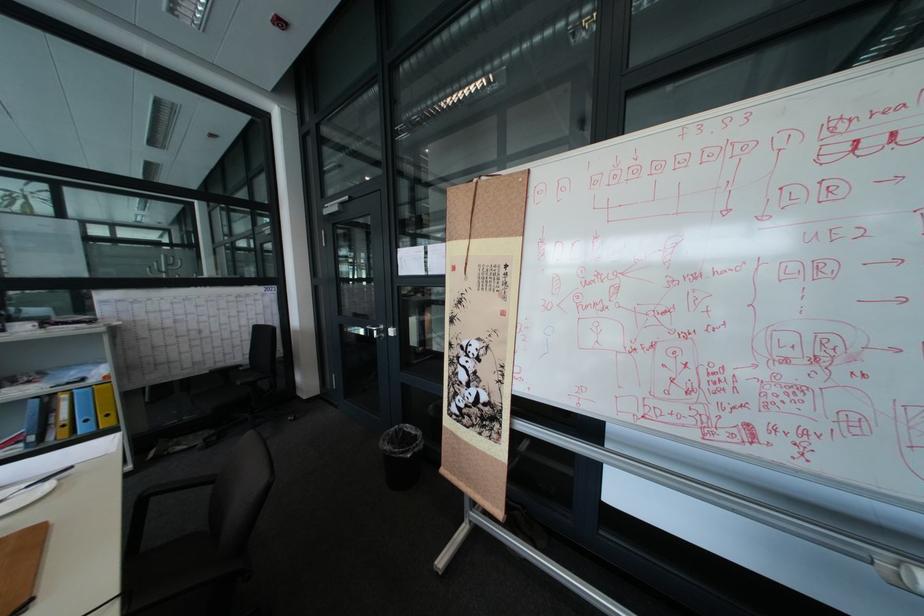
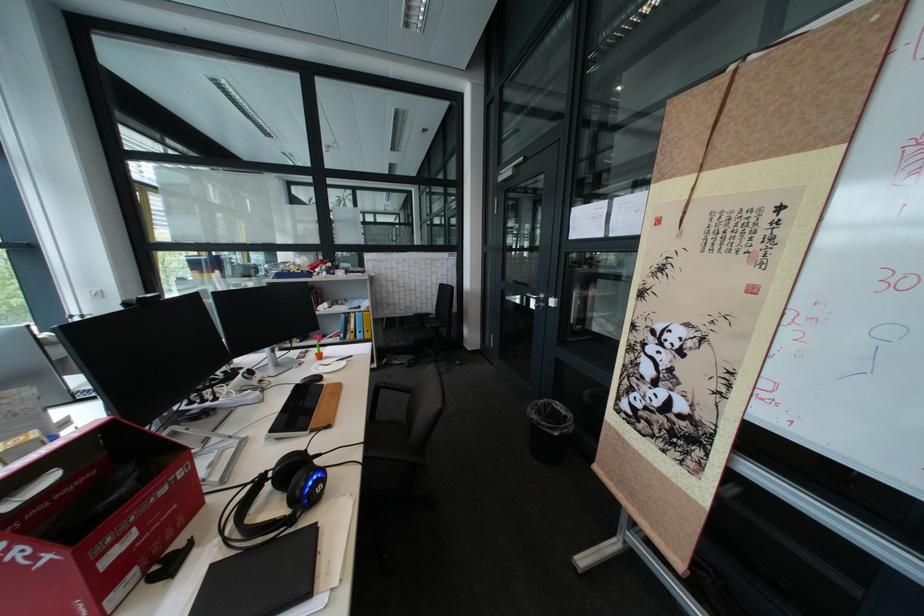
In the second image, find the point that corresponds to (382,328) in the first image.

(541, 294)